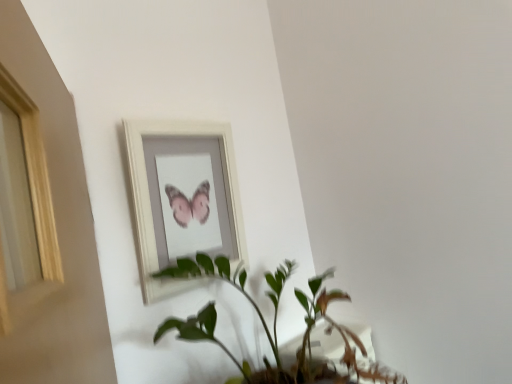
At what (x,y) coordinates should I click in order to perform the action: click on green leafy plant at center. Please return your answer as a coordinate pair (x, y). The height and width of the screenshot is (384, 512). Looking at the image, I should click on (273, 323).

What do you see at coordinates (273, 323) in the screenshot? This screenshot has height=384, width=512. I see `green leafy plant at center` at bounding box center [273, 323].

What is the approximate width of green leafy plant at center?

green leafy plant at center is 22.47 inches in width.

Locate an element on the screen. This screenshot has width=512, height=384. white wooden picture frame at upper center is located at coordinates (182, 198).

What do you see at coordinates (182, 198) in the screenshot?
I see `white wooden picture frame at upper center` at bounding box center [182, 198].

This screenshot has height=384, width=512. What are the coordinates of `green leafy plant at center` in the screenshot? It's located at (273, 323).

Is white wooden picture frame at upper center to the right of green leafy plant at center from the viewer's perspective?

Result: No.

In the image, is white wooden picture frame at upper center positioned in front of or behind green leafy plant at center?

white wooden picture frame at upper center is behind green leafy plant at center.

Does point (148, 261) appear closer or farther from the camera than point (301, 366)?

Clearly, point (148, 261) is closer to the camera than point (301, 366).

From the image's perspective, is white wooden picture frame at upper center located above or below green leafy plant at center?

Clearly, from the image's perspective, white wooden picture frame at upper center is above green leafy plant at center.

From a real-world perspective, who is located lower, white wooden picture frame at upper center or green leafy plant at center?

green leafy plant at center, from a real-world perspective.

In terms of width, does white wooden picture frame at upper center look wider or thinner when compared to green leafy plant at center?

Considering their sizes, white wooden picture frame at upper center looks slimmer than green leafy plant at center.

Considering the relative sizes of white wooden picture frame at upper center and green leafy plant at center in the image provided, is white wooden picture frame at upper center taller than green leafy plant at center?

Yes.

Who is bigger, white wooden picture frame at upper center or green leafy plant at center?

green leafy plant at center.

Is white wooden picture frame at upper center not inside green leafy plant at center?

Yes, white wooden picture frame at upper center is not within green leafy plant at center.

Is white wooden picture frame at upper center directly adjacent to green leafy plant at center?

white wooden picture frame at upper center is not next to green leafy plant at center, and they're not touching.

Is white wooden picture frame at upper center oriented towards green leafy plant at center?

Yes, white wooden picture frame at upper center is aimed at green leafy plant at center.

Can you tell me how much white wooden picture frame at upper center and green leafy plant at center differ in facing direction?

There is a 0.000306-degree angle between the facing directions of white wooden picture frame at upper center and green leafy plant at center.

This screenshot has height=384, width=512. I want to click on houseplant in front of the white wooden picture frame at upper center, so click(273, 323).

Which is more to the left, green leafy plant at center or white wooden picture frame at upper center?

white wooden picture frame at upper center is more to the left.

Considering the positions of objects green leafy plant at center and white wooden picture frame at upper center in the image provided, who is in front, green leafy plant at center or white wooden picture frame at upper center?

green leafy plant at center is in front.

Considering the points (311, 379) and (226, 127), which point is in front, point (311, 379) or point (226, 127)?

The point (311, 379) is closer to the camera.

From the image's perspective, is green leafy plant at center located beneath white wooden picture frame at upper center?

Indeed, from the image's perspective, green leafy plant at center is shown beneath white wooden picture frame at upper center.

From a real-world perspective, is green leafy plant at center physically located above or below white wooden picture frame at upper center?

green leafy plant at center is situated lower than white wooden picture frame at upper center in the real world.

Considering the sizes of objects green leafy plant at center and white wooden picture frame at upper center in the image provided, who is wider, green leafy plant at center or white wooden picture frame at upper center?

With larger width is green leafy plant at center.

From their relative heights in the image, would you say green leafy plant at center is taller or shorter than white wooden picture frame at upper center?

green leafy plant at center is shorter than white wooden picture frame at upper center.

Is green leafy plant at center bigger or smaller than white wooden picture frame at upper center?

green leafy plant at center is bigger than white wooden picture frame at upper center.

Would you say green leafy plant at center is outside white wooden picture frame at upper center?

Yes, green leafy plant at center is located beyond the bounds of white wooden picture frame at upper center.

Can you see green leafy plant at center touching white wooden picture frame at upper center?

No, green leafy plant at center is not with white wooden picture frame at upper center.

Is green leafy plant at center oriented towards white wooden picture frame at upper center?

No, green leafy plant at center is not turned towards white wooden picture frame at upper center.

How different are the orientations of green leafy plant at center and white wooden picture frame at upper center in degrees?

There is a 0.000306-degree angle between the facing directions of green leafy plant at center and white wooden picture frame at upper center.

Measure the distance from green leafy plant at center to white wooden picture frame at upper center.

green leafy plant at center and white wooden picture frame at upper center are 8.69 inches apart.

Where is `picture frame on the left of the green leafy plant at center`? The height and width of the screenshot is (384, 512). picture frame on the left of the green leafy plant at center is located at coordinates (182, 198).

Locate an element on the screen. houseplant that is on the right side of white wooden picture frame at upper center is located at coordinates (273, 323).

Find the location of a particular element. picture frame above the green leafy plant at center (from a real-world perspective) is located at coordinates (182, 198).